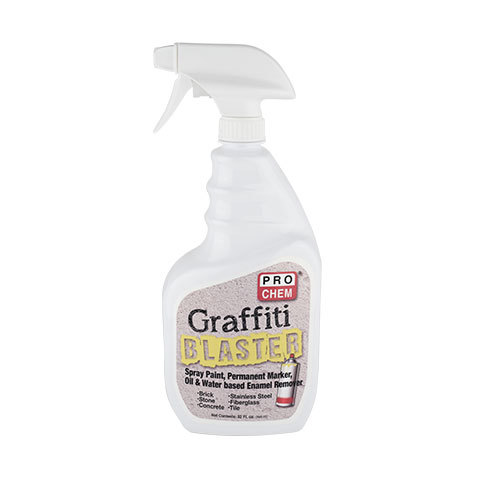
Identify the location of bottle. The image size is (500, 500). (253, 240).